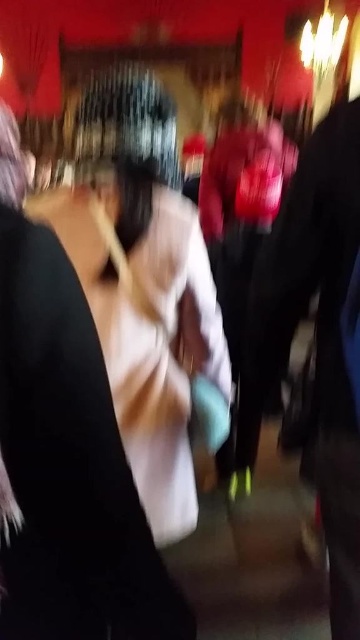
You are at a social event and want to take a clearer photo of the scene. The camera you have can focus up to 20 inches. Is the point at coordinates point (59, 433) within the camera focus range?

The distance between point (59, 433) and the camera is 19.19 inches, which is within the camera focus range of up to 20 inches. Therefore, the point is within the focus range.